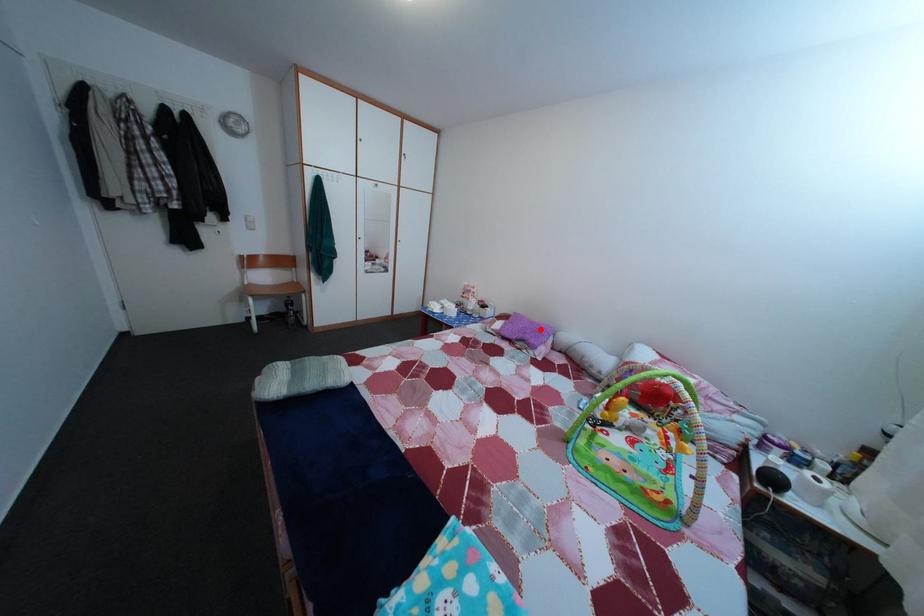
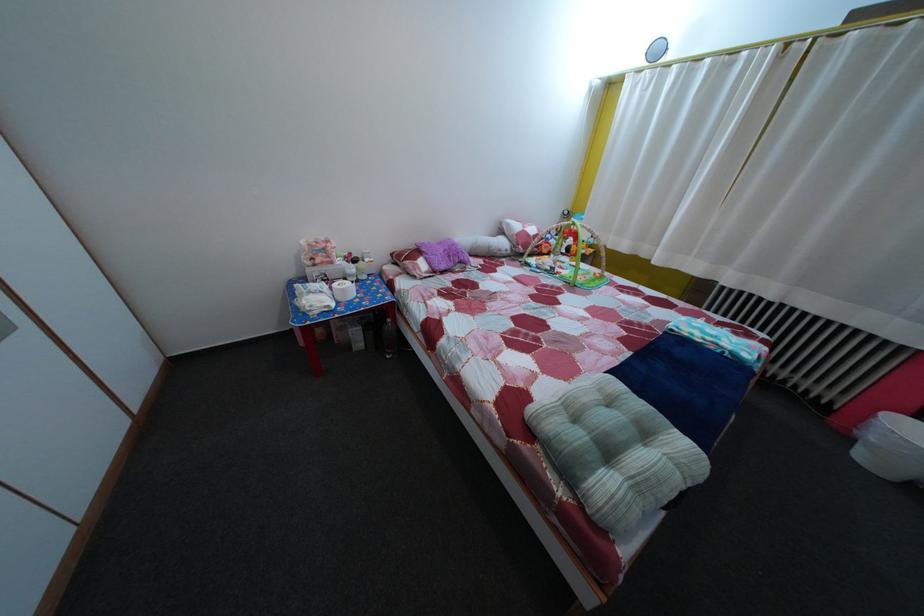
Question: I am providing you with two images of the same scene from different viewpoints. Image1 has a red point marked. In image2, the corresponding 3D location appears at what relative position? Reply with the corresponding letter.

Choices:
 (A) Closer
 (B) Farther

Answer: (A)